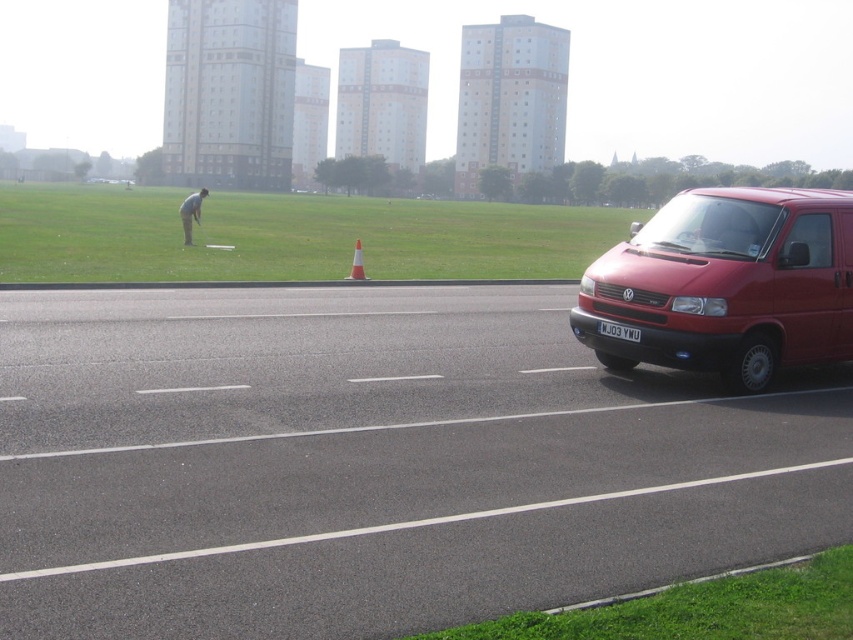
You are a delivery person trying to deliver a package to the smooth gray shirt at center. You have a box that is 1.2 meters in length. Can you carry the box while walking past the orange cone at center without dropping it?

The smooth gray shirt at center is larger than the orange cone at center, so the box can be carried past the cone without any issue as the shirt wearer has a bigger size to handle the package safely.

You are a pedestrian standing on the grassy area and want to walk to the matte red van at right. Is the smooth gray shirt at center blocking your path?

The matte red van at right is closer to the viewer than the smooth gray shirt at center, so the smooth gray shirt at center is behind the van and not blocking your path.

You are a delivery driver who needs to park your truck in this area. The truck requires a space that can accommodate vehicles larger than the orange cone at center. Can the space near the matte red van at right provide enough room for your truck?

The matte red van at right is larger in size than the orange cone at center, so the space near the matte red van at right can accommodate vehicles larger than the orange cone at center, meaning your truck should fit there.